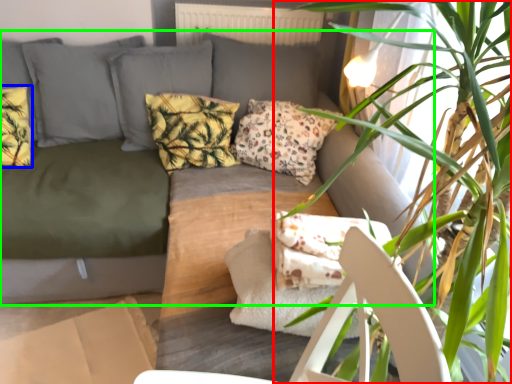
Question: Which object is the farthest from houseplant (highlighted by a red box)? Choose among these: pillow (highlighted by a blue box) or studio couch (highlighted by a green box).

Choices:
 (A) pillow
 (B) studio couch

Answer: (A)